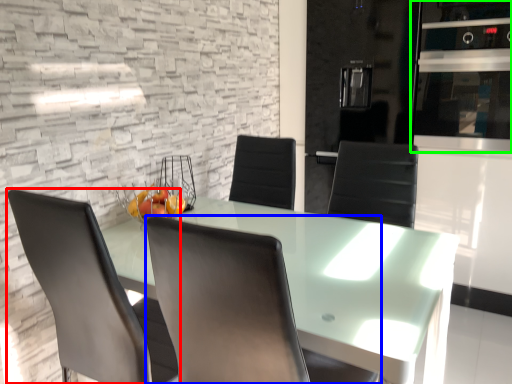
Question: Which object is the farthest from chair (highlighted by a red box)? Choose among these: chair (highlighted by a blue box) or appliance (highlighted by a green box).

Choices:
 (A) chair
 (B) appliance

Answer: (B)